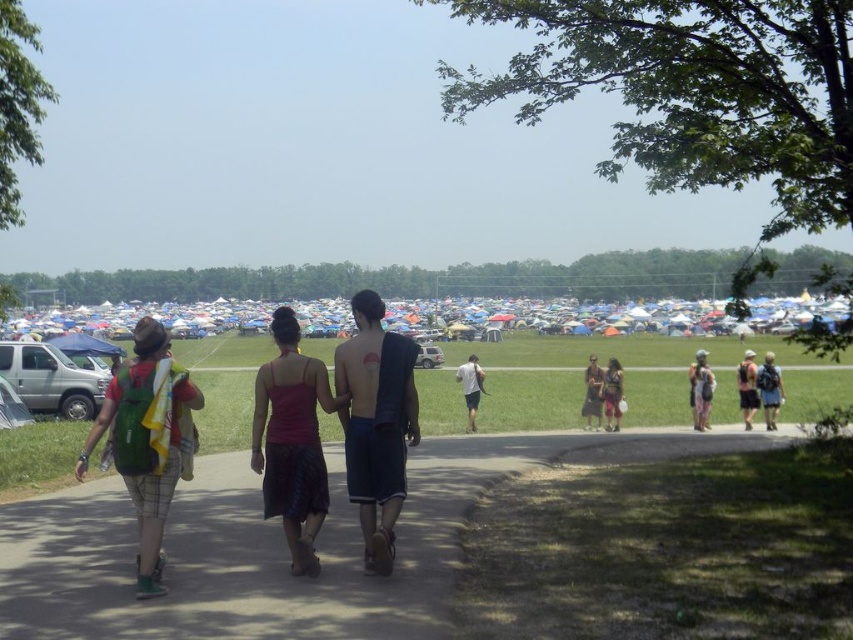
You are standing at the edge of the grassy field and see both the green backpack at center and the matte black dress at center. Which object is located to the right of the other?

The green backpack at center is positioned on the right side of matte black dress at center.

You are standing at the center of the image and want to locate the point at coordinates (x=700, y=388). Which object is this point located on?

The point at coordinates (x=700, y=388) is located on the matte green backpack at right.